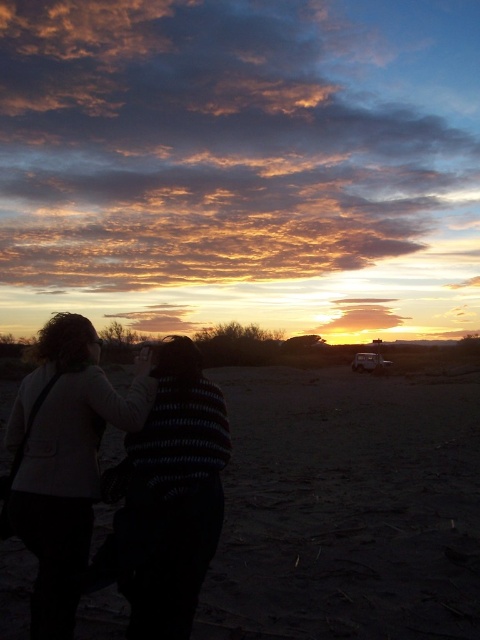
You are standing in the desert watching the sunset and see two points in the scene. One is at point (7, 442) and the other is at point (207, 468). Which point is closer to you?

Point (7, 442) is further to the camera than point (207, 468), so the point closer to you is point (207, 468).